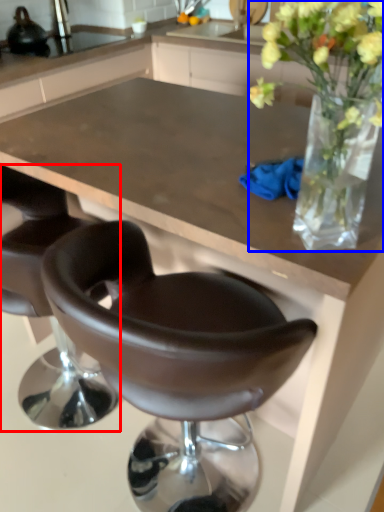
Question: Which point is closer to the camera, chair (highlighted by a red box) or floral arrangement (highlighted by a blue box)?

Choices:
 (A) chair
 (B) floral arrangement

Answer: (B)